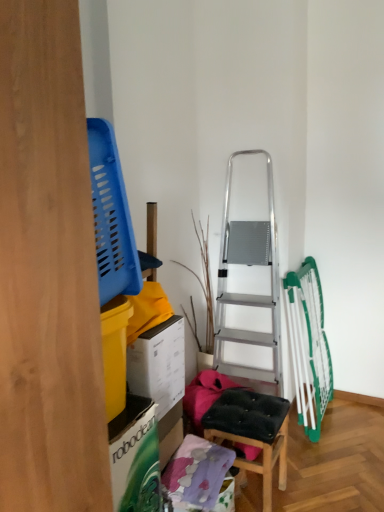
Question: Considering their positions, is black padded stool at center located in front of or behind white cardboard box at left?

Choices:
 (A) behind
 (B) front

Answer: (A)

Question: Considering the positions of black padded stool at center and white cardboard box at left in the image, is black padded stool at center wider or thinner than white cardboard box at left?

Choices:
 (A) thin
 (B) wide

Answer: (B)

Question: Is black padded stool at center to the left or to the right of white cardboard box at left in the image?

Choices:
 (A) right
 (B) left

Answer: (A)

Question: From the image's perspective, is white cardboard box at left located above or below black padded stool at center?

Choices:
 (A) below
 (B) above

Answer: (B)

Question: In terms of width, does white cardboard box at left look wider or thinner when compared to black padded stool at center?

Choices:
 (A) thin
 (B) wide

Answer: (A)

Question: Would you say white cardboard box at left is to the left or to the right of black padded stool at center in the picture?

Choices:
 (A) right
 (B) left

Answer: (B)

Question: Is white cardboard box at left spatially inside black padded stool at center, or outside of it?

Choices:
 (A) inside
 (B) outside

Answer: (B)